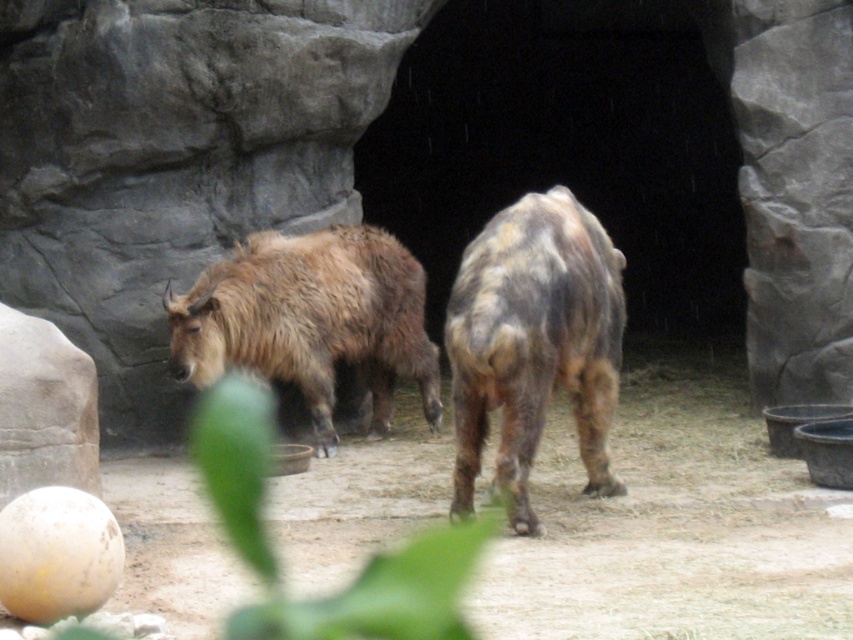
Is brown fuzzy yak at center wider than fuzzy brown yak at center?

No.

Who is positioned more to the left, brown fuzzy yak at center or fuzzy brown yak at center?

Positioned to the left is fuzzy brown yak at center.

Who is more distant from viewer, (596,339) or (206,310)?

Point (206,310)

At what (x,y) coordinates should I click in order to perform the action: click on brown fuzzy yak at center. Please return your answer as a coordinate pair (x, y). Image resolution: width=853 pixels, height=640 pixels. Looking at the image, I should click on (534, 344).